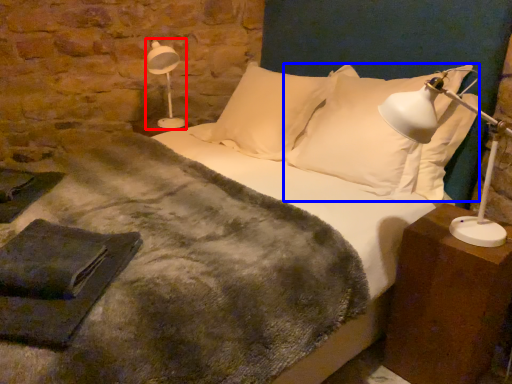
Question: Which point is closer to the camera, lamp (highlighted by a red box) or pillow (highlighted by a blue box)?

Choices:
 (A) lamp
 (B) pillow

Answer: (B)